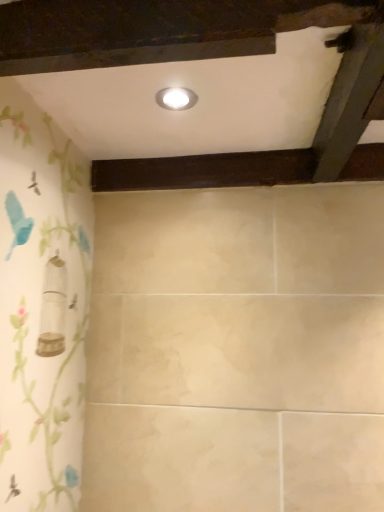
The image size is (384, 512). Describe the element at coordinates (176, 98) in the screenshot. I see `white glossy light fixture at upper center` at that location.

Identify the location of white glossy light fixture at upper center. The image size is (384, 512). (176, 98).

This screenshot has height=512, width=384. Describe the element at coordinates (205, 170) in the screenshot. I see `dark wood plank at center` at that location.

The image size is (384, 512). Identify the location of dark wood plank at center. (205, 170).

Where is `white glossy light fixture at upper center`? This screenshot has height=512, width=384. white glossy light fixture at upper center is located at coordinates (176, 98).

Considering the relative positions of dark wood plank at center and white glossy light fixture at upper center in the image provided, is dark wood plank at center to the right of white glossy light fixture at upper center from the viewer's perspective?

Indeed, dark wood plank at center is positioned on the right side of white glossy light fixture at upper center.

Is dark wood plank at center positioned behind white glossy light fixture at upper center?

Yes, dark wood plank at center is further from the camera.

Considering the positions of points (282, 164) and (187, 106), is point (282, 164) closer to camera compared to point (187, 106)?

No.

From the image's perspective, between dark wood plank at center and white glossy light fixture at upper center, who is located below?

From the image's view, dark wood plank at center is below.

In the scene shown: From a real-world perspective, which is physically above, dark wood plank at center or white glossy light fixture at upper center?

In real-world perspective, white glossy light fixture at upper center is above.

From the picture: Is dark wood plank at center thinner than white glossy light fixture at upper center?

Incorrect, the width of dark wood plank at center is not less than that of white glossy light fixture at upper center.

Which of these two, dark wood plank at center or white glossy light fixture at upper center, stands shorter?

Standing shorter between the two is white glossy light fixture at upper center.

Considering the sizes of objects dark wood plank at center and white glossy light fixture at upper center in the image provided, who is bigger, dark wood plank at center or white glossy light fixture at upper center?

Bigger between the two is dark wood plank at center.

From the picture: Is dark wood plank at center not inside white glossy light fixture at upper center?

Yes, dark wood plank at center is located beyond the bounds of white glossy light fixture at upper center.

From the picture: Is there a large distance between dark wood plank at center and white glossy light fixture at upper center?

They are positioned close to each other.

Could you tell me if dark wood plank at center is turned towards white glossy light fixture at upper center?

No, dark wood plank at center is not facing towards white glossy light fixture at upper center.

The height and width of the screenshot is (512, 384). What are the coordinates of `plank that appears below the white glossy light fixture at upper center (from the image's perspective)` in the screenshot? It's located at (205, 170).

Does white glossy light fixture at upper center appear on the left side of dark wood plank at center?

Correct, you'll find white glossy light fixture at upper center to the left of dark wood plank at center.

Is the position of white glossy light fixture at upper center more distant than that of dark wood plank at center?

No, white glossy light fixture at upper center is closer to the viewer.

Which is more distant, (176, 93) or (138, 177)?

Positioned behind is point (138, 177).

From the image's perspective, is white glossy light fixture at upper center below dark wood plank at center?

Actually, white glossy light fixture at upper center appears above dark wood plank at center in the image.

Looking at this image, from a real-world perspective, is white glossy light fixture at upper center on dark wood plank at center?

Yes, from a real-world perspective, white glossy light fixture at upper center is over dark wood plank at center

From the picture: Is white glossy light fixture at upper center wider than dark wood plank at center?

No, white glossy light fixture at upper center is not wider than dark wood plank at center.

Considering the sizes of white glossy light fixture at upper center and dark wood plank at center in the image, is white glossy light fixture at upper center taller or shorter than dark wood plank at center?

In the image, white glossy light fixture at upper center appears to be shorter than dark wood plank at center.

Based on their sizes in the image, would you say white glossy light fixture at upper center is bigger or smaller than dark wood plank at center?

Considering their sizes, white glossy light fixture at upper center takes up less space than dark wood plank at center.

Looking at this image, is white glossy light fixture at upper center completely or partially outside of dark wood plank at center?

white glossy light fixture at upper center is positioned outside dark wood plank at center.

Is white glossy light fixture at upper center beside dark wood plank at center?

They are not placed beside each other.

Is white glossy light fixture at upper center turned away from dark wood plank at center?

No, white glossy light fixture at upper center is not facing the opposite direction of dark wood plank at center.

How different are the orientations of white glossy light fixture at upper center and dark wood plank at center in degrees?

0.509 degrees.

How distant is white glossy light fixture at upper center from dark wood plank at center?

The distance of white glossy light fixture at upper center from dark wood plank at center is 33.85 centimeters.

The image size is (384, 512). In order to click on light fixture above the dark wood plank at center (from a real-world perspective) in this screenshot , I will do (176, 98).

Identify the location of plank on the right of white glossy light fixture at upper center. (205, 170).

What are the coordinates of `light fixture in front of the dark wood plank at center` in the screenshot? It's located at (176, 98).